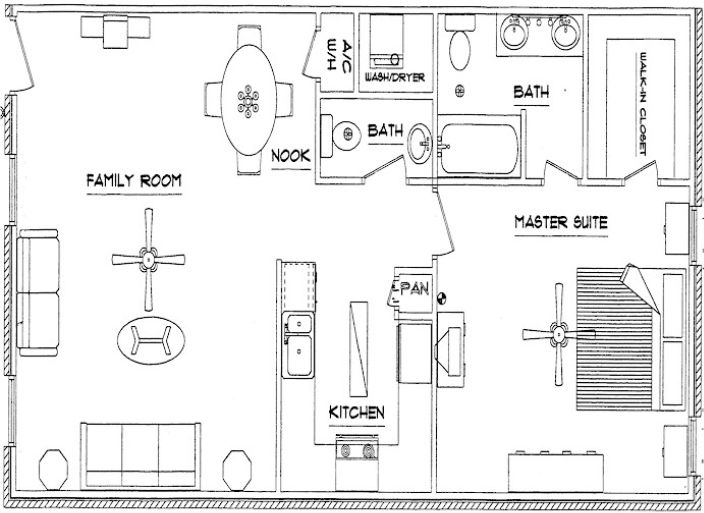
Locate an element on the screen. This screenshot has width=704, height=513. bed is located at coordinates (634, 346).